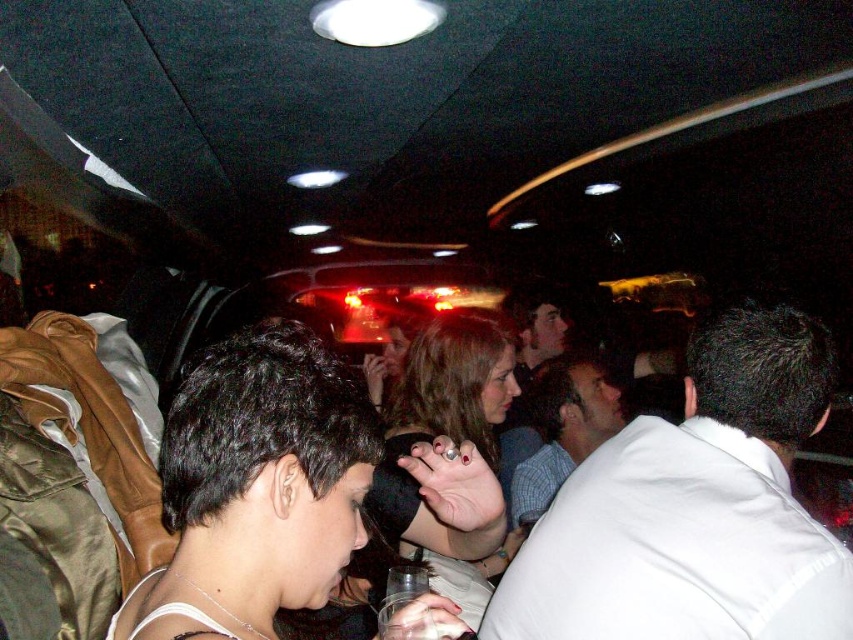
Which is behind, point (779, 316) or point (585, 408)?

The point (585, 408) is behind.

Does white cotton shirt at center appear on the left side of white shirt at center?

Incorrect, white cotton shirt at center is not on the left side of white shirt at center.

Measure the distance between white cotton shirt at center and camera.

38.20 inches

Find the location of a particular element. The width and height of the screenshot is (853, 640). white cotton shirt at center is located at coordinates (694, 508).